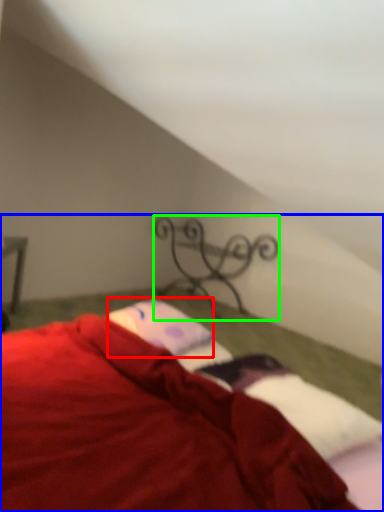
Question: Estimate the real-world distances between objects in this image. Which object is farther from pillow (highlighted by a red box), bed (highlighted by a blue box) or design (highlighted by a green box)?

Choices:
 (A) bed
 (B) design

Answer: (B)